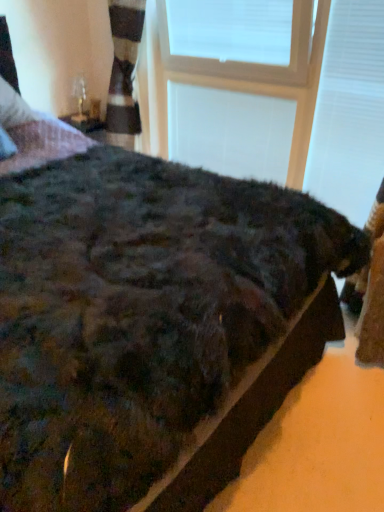
Measure the distance between point (294, 60) and camera.

The distance of point (294, 60) from camera is 2.05 meters.

Find the location of a particular element. white plastic window frame at upper center, acting as the second window frame starting from the front is located at coordinates (230, 131).

Measure the distance between clear glass table lamp at upper left and white plastic window frame at upper center, acting as the second window frame starting from the back.

36.34 inches.

Does clear glass table lamp at upper left contain white plastic window frame at upper center, acting as the second window frame starting from the back?

No, white plastic window frame at upper center, acting as the second window frame starting from the back, is located outside of clear glass table lamp at upper left.

Can you confirm if clear glass table lamp at upper left is thinner than white plastic window frame at upper center, the 1th window frame from the front?

Yes, clear glass table lamp at upper left is thinner than white plastic window frame at upper center, the 1th window frame from the front.

From the image's perspective, between clear glass table lamp at upper left and white plastic window frame at upper center, acting as the second window frame starting from the back, who is located below?

white plastic window frame at upper center, acting as the second window frame starting from the back, from the image's perspective.

Does white plastic window frame at upper center, the 1th window frame from the front, appear on the left side of clear glass table lamp at upper left?

Incorrect, white plastic window frame at upper center, the 1th window frame from the front, is not on the left side of clear glass table lamp at upper left.

What's the angular difference between white plastic window frame at upper center, acting as the second window frame starting from the back, and clear glass table lamp at upper left's facing directions?

They differ by 90.5 degrees in their facing directions.

Considering the relative sizes of white plastic window frame at upper center, the 1th window frame from the front, and clear glass table lamp at upper left in the image provided, is white plastic window frame at upper center, the 1th window frame from the front, taller than clear glass table lamp at upper left?

Correct, white plastic window frame at upper center, the 1th window frame from the front, is much taller as clear glass table lamp at upper left.

Does white plastic window frame at upper center, acting as the second window frame starting from the back, come in front of clear glass table lamp at upper left?

Yes, the depth of white plastic window frame at upper center, acting as the second window frame starting from the back, is less than that of clear glass table lamp at upper left.

From a real-world perspective, relative to clear glass table lamp at upper left, is white plastic window frame at upper center, acting as the second window frame starting from the front, vertically above or below?

white plastic window frame at upper center, acting as the second window frame starting from the front, is situated lower than clear glass table lamp at upper left in the real world.

Is white plastic window frame at upper center, acting as the second window frame starting from the front, closer to camera compared to clear glass table lamp at upper left?

Yes.

You are a GUI agent. You are given a task and a screenshot of the screen. Output one action in this format:
    pyautogui.click(x=<x>, y=<y>)
    Task: Click on the table lamp lying on the left of white plastic window frame at upper center, acting as the second window frame starting from the front
    The image size is (384, 512).
    Given the screenshot: What is the action you would take?
    pyautogui.click(x=79, y=100)

Is white plastic window frame at upper center, acting as the second window frame starting from the front, to the left of clear glass table lamp at upper left from the viewer's perspective?

Incorrect, white plastic window frame at upper center, acting as the second window frame starting from the front, is not on the left side of clear glass table lamp at upper left.

Is clear glass table lamp at upper left turned away from white plastic window frame at upper center, which appears as the 1th window frame when viewed from the back?

That's not correct — clear glass table lamp at upper left is not looking away from white plastic window frame at upper center, which appears as the 1th window frame when viewed from the back.

Is clear glass table lamp at upper left shorter than white plastic window frame at upper center, which appears as the 1th window frame when viewed from the back?

Indeed, clear glass table lamp at upper left has a lesser height compared to white plastic window frame at upper center, which appears as the 1th window frame when viewed from the back.

Is point (84, 92) closer or farther from the camera than point (206, 103)?

Point (84, 92).

In the scene shown: Considering the positions of objects clear glass table lamp at upper left and white plastic window frame at upper center, acting as the second window frame starting from the front, in the image provided, who is more to the left, clear glass table lamp at upper left or white plastic window frame at upper center, acting as the second window frame starting from the front,?

Positioned to the left is clear glass table lamp at upper left.

Between white plastic window frame at upper center, which appears as the 1th window frame when viewed from the back, and white plastic window frame at upper center, the 1th window frame from the front, which one has larger width?

With larger width is white plastic window frame at upper center, the 1th window frame from the front.

Could you tell me if white plastic window frame at upper center, acting as the second window frame starting from the front, is facing white plastic window frame at upper center, acting as the second window frame starting from the back?

Yes, white plastic window frame at upper center, acting as the second window frame starting from the front, faces towards white plastic window frame at upper center, acting as the second window frame starting from the back.

Would you say white plastic window frame at upper center, which appears as the 1th window frame when viewed from the back, is outside white plastic window frame at upper center, acting as the second window frame starting from the back?

No, white plastic window frame at upper center, which appears as the 1th window frame when viewed from the back, is inside or overlapping with white plastic window frame at upper center, acting as the second window frame starting from the back.

Can you confirm if white plastic window frame at upper center, the 1th window frame from the front, is positioned to the left of white plastic window frame at upper center, acting as the second window frame starting from the front?

No.

Is white plastic window frame at upper center, the 1th window frame from the front, directly adjacent to white plastic window frame at upper center, which appears as the 1th window frame when viewed from the back?

No.

From the image's perspective, which is below, white plastic window frame at upper center, the 1th window frame from the front, or white plastic window frame at upper center, which appears as the 1th window frame when viewed from the back?

white plastic window frame at upper center, which appears as the 1th window frame when viewed from the back, from the image's perspective.

From a real-world perspective, between white plastic window frame at upper center, the 1th window frame from the front, and white plastic window frame at upper center, acting as the second window frame starting from the front, who is vertically higher?

From a 3D spatial view, white plastic window frame at upper center, the 1th window frame from the front, is above.

At what (x,y) coordinates should I click in order to perform the action: click on table lamp located above the white plastic window frame at upper center, the 1th window frame from the front (from the image's perspective). Please return your answer as a coordinate pair (x, y). Looking at the image, I should click on (79, 100).

Where is `table lamp on the left of white plastic window frame at upper center, acting as the second window frame starting from the back`? table lamp on the left of white plastic window frame at upper center, acting as the second window frame starting from the back is located at coordinates (79, 100).

When comparing their distances from white plastic window frame at upper center, acting as the second window frame starting from the back, does white plastic window frame at upper center, acting as the second window frame starting from the front, or clear glass table lamp at upper left seem closer?

Among the two, white plastic window frame at upper center, acting as the second window frame starting from the front, is located nearer to white plastic window frame at upper center, acting as the second window frame starting from the back.

Which object lies further to the anchor point white plastic window frame at upper center, acting as the second window frame starting from the front, white plastic window frame at upper center, acting as the second window frame starting from the back, or clear glass table lamp at upper left?

Based on the image, clear glass table lamp at upper left appears to be further to white plastic window frame at upper center, acting as the second window frame starting from the front.

Which object lies further to the anchor point clear glass table lamp at upper left, white plastic window frame at upper center, acting as the second window frame starting from the front, or white plastic window frame at upper center, acting as the second window frame starting from the back?

white plastic window frame at upper center, acting as the second window frame starting from the front, is positioned further to the anchor clear glass table lamp at upper left.

Considering their positions, is clear glass table lamp at upper left positioned closer to white plastic window frame at upper center, acting as the second window frame starting from the front, than white plastic window frame at upper center, acting as the second window frame starting from the back?

white plastic window frame at upper center, acting as the second window frame starting from the back.

When comparing their distances from white plastic window frame at upper center, the 1th window frame from the front, does clear glass table lamp at upper left or white plastic window frame at upper center, acting as the second window frame starting from the front, seem closer?

The object closer to white plastic window frame at upper center, the 1th window frame from the front, is white plastic window frame at upper center, acting as the second window frame starting from the front.

Estimate the real-world distances between objects in this image. Which object is further from clear glass table lamp at upper left, white plastic window frame at upper center, acting as the second window frame starting from the back, or white plastic window frame at upper center, acting as the second window frame starting from the front?

white plastic window frame at upper center, acting as the second window frame starting from the front, is further to clear glass table lamp at upper left.

The image size is (384, 512). Identify the location of window frame situated between clear glass table lamp at upper left and white plastic window frame at upper center, acting as the second window frame starting from the back, from left to right. (230, 131).